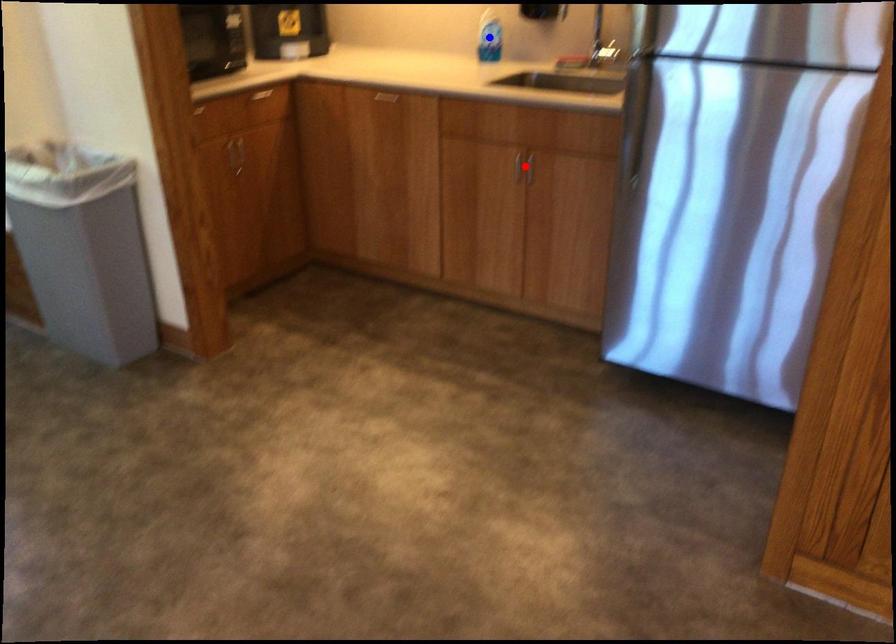
Question: Which of the two points in the image is closer to the camera?

Choices:
 (A) Blue point is closer.
 (B) Red point is closer.

Answer: (B)